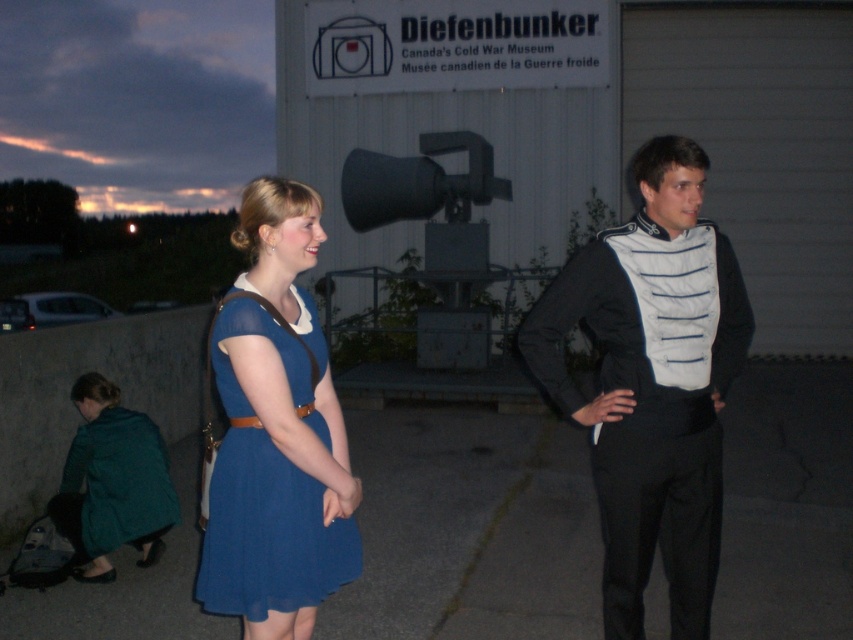
From the picture: Can you confirm if black fabric vest at center is wider than matte blue dress at center?

Yes.

Who is positioned more to the left, black fabric vest at center or matte blue dress at center?

From the viewer's perspective, matte blue dress at center appears more on the left side.

Identify the location of black fabric vest at center. The width and height of the screenshot is (853, 640). (653, 384).

Locate an element on the screen. black fabric vest at center is located at coordinates (653, 384).

Which is above, black fabric vest at center or teal fabric coat at lower left?

black fabric vest at center

Does point (637, 538) come in front of point (102, 376)?

Yes.

Locate an element on the screen. black fabric vest at center is located at coordinates coord(653,384).

Is matte blue dress at center above teal fabric coat at lower left?

Correct, matte blue dress at center is located above teal fabric coat at lower left.

Does matte blue dress at center appear under teal fabric coat at lower left?

Incorrect, matte blue dress at center is not positioned below teal fabric coat at lower left.

Is point (236, 404) positioned behind point (77, 440)?

That is False.

Locate an element on the screen. matte blue dress at center is located at coordinates pyautogui.click(x=270, y=483).